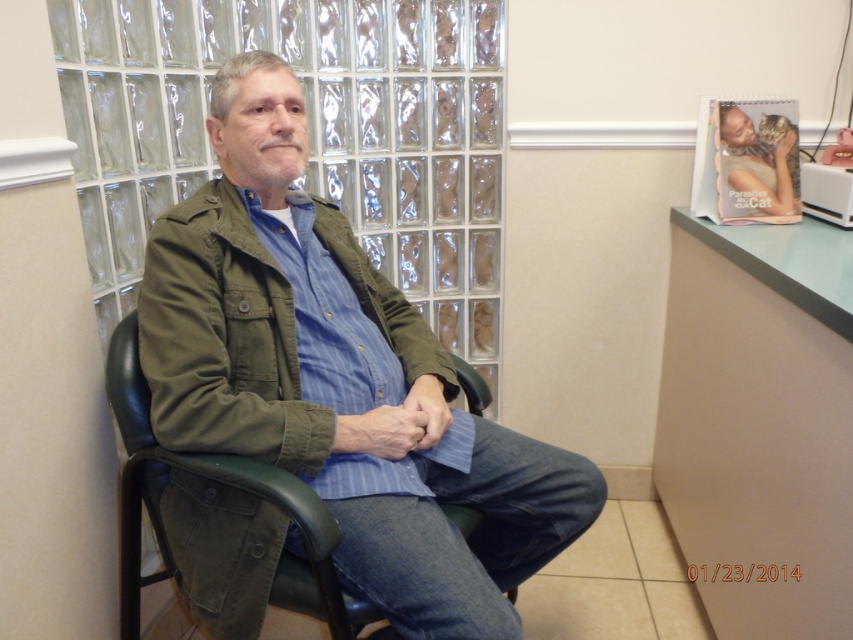
You are an assistant organizing a wardrobe. You see the matte green jacket at center and the olive green fabric jacket at center. Which jacket is positioned lower on the person?

The matte green jacket at center is located below the olive green fabric jacket at center, so the matte green jacket at center is positioned lower on the person.

You are an interior designer planning to place a new decorative item on the desk. The desk is located to the right of the matte green jacket at center. Where should you place the item to ensure it is visible from the current viewpoint?

Since the desk is to the right of the matte green jacket at center, placing the decorative item on the right side of the desk would keep it within the visible area from the current viewpoint.

You are an interior designer trying to rearrange the office. You need to place a new plant pot between the olive green fabric jacket at center and the green leather chair at center. Where should you place the plant pot?

The plant pot should be placed between the olive green fabric jacket at center and the green leather chair at center, to the left of the olive green fabric jacket at center and to the right of the green leather chair at center since the jacket is on the right side of the chair.